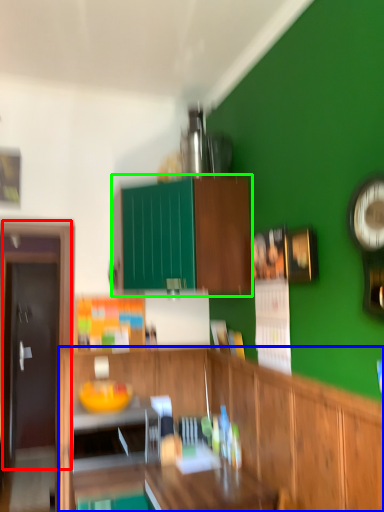
Question: Which object is positioned closest to door (highlighted by a red box)? Select from cabinetry (highlighted by a blue box) and cabinetry (highlighted by a green box).

Choices:
 (A) cabinetry
 (B) cabinetry

Answer: (B)